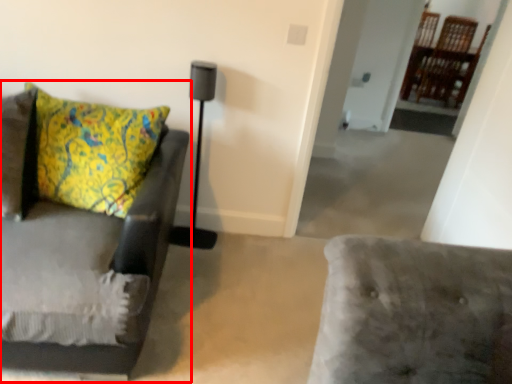
Question: Where is studio couch (annotated by the red box) located in relation to table lamp in the image?

Choices:
 (A) right
 (B) left

Answer: (B)